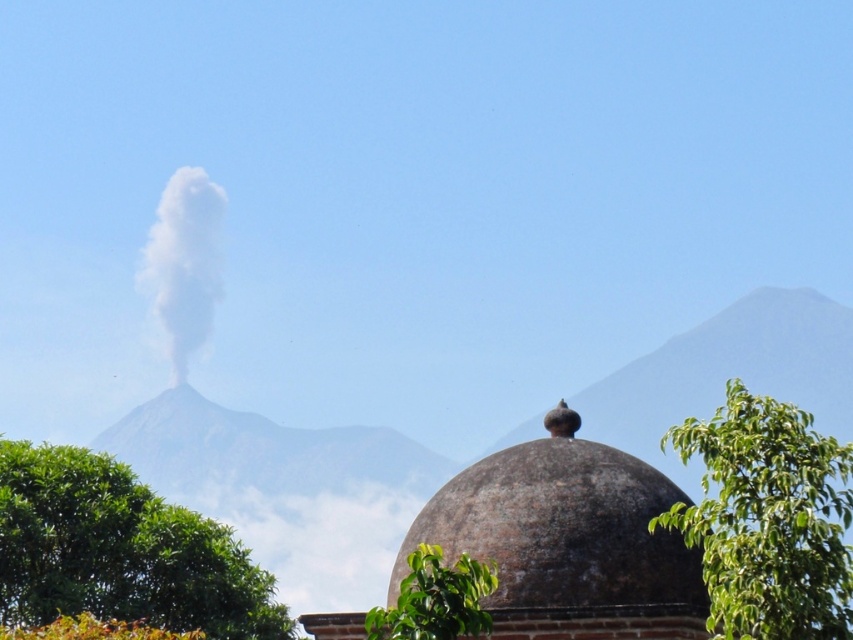
Question: Can you confirm if white smoke at center is wider than green leafy tree at lower center?

Choices:
 (A) yes
 (B) no

Answer: (A)

Question: Does rustic stone dome at center have a greater width compared to green leafy tree at center?

Choices:
 (A) no
 (B) yes

Answer: (A)

Question: Among these points, which one is nearest to the camera?

Choices:
 (A) (173, 285)
 (B) (474, 612)
 (C) (492, 456)
 (D) (138, 600)

Answer: (B)

Question: Which point is farther from the camera taking this photo?

Choices:
 (A) (451, 637)
 (B) (123, 532)
 (C) (666, 636)

Answer: (B)

Question: Which of the following is the farthest from the observer?

Choices:
 (A) (165, 332)
 (B) (786, 618)

Answer: (A)

Question: Does green leafy tree at lower right lie in front of white smoke at center?

Choices:
 (A) no
 (B) yes

Answer: (B)